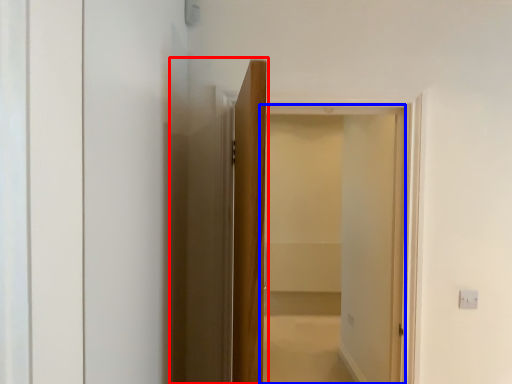
Question: Which point is closer to the camera, elevator (highlighted by a red box) or screen door (highlighted by a blue box)?

Choices:
 (A) elevator
 (B) screen door

Answer: (A)